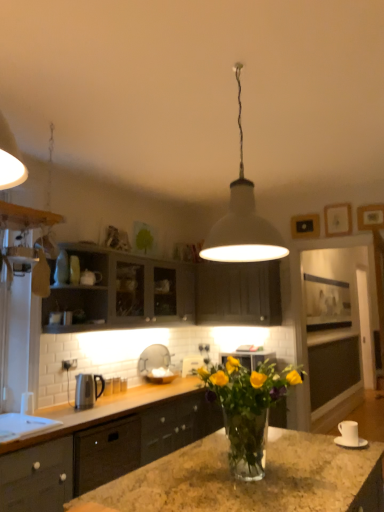
Locate an element on the screen. This screenshot has height=512, width=384. vacant space to the right of satin black kettle at left, which is the third appliance in right-to-left order is located at coordinates (119, 405).